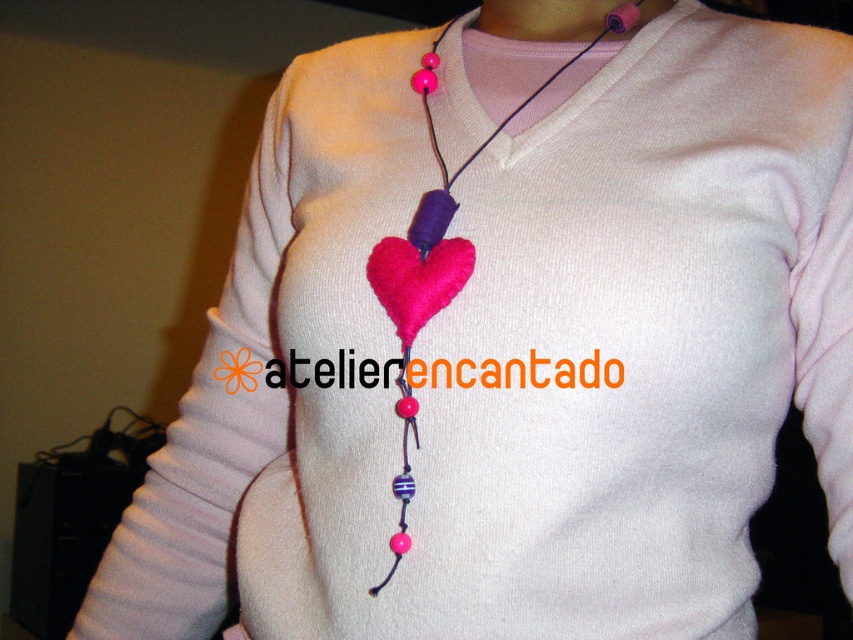
Consider the image. Who is taller, felt heart at center or fuzzy pink heart at center?

felt heart at center is taller.

Is felt heart at center smaller than fuzzy pink heart at center?

No, felt heart at center is not smaller than fuzzy pink heart at center.

Between point (399, 518) and point (395, 266), which one is positioned behind?

Point (395, 266)

Locate an element on the screen. This screenshot has width=853, height=640. felt heart at center is located at coordinates (426, 273).

Is felt heart at center below pink matte necklace at upper center?

Correct, felt heart at center is located below pink matte necklace at upper center.

Does felt heart at center appear on the right side of pink matte necklace at upper center?

In fact, felt heart at center is to the left of pink matte necklace at upper center.

This screenshot has height=640, width=853. Describe the element at coordinates (426, 273) in the screenshot. I see `felt heart at center` at that location.

At what (x,y) coordinates should I click in order to perform the action: click on felt heart at center. Please return your answer as a coordinate pair (x, y). The image size is (853, 640). Looking at the image, I should click on (426, 273).

Where is `pink matte necklace at upper center`? The image size is (853, 640). pink matte necklace at upper center is located at coordinates (543, 19).

Which of these two, pink matte necklace at upper center or purple felt heart at center, stands taller?

pink matte necklace at upper center

Is point (491, 29) farther from camera compared to point (616, 33)?

Yes, point (491, 29) is farther from viewer.

I want to click on pink matte necklace at upper center, so click(x=543, y=19).